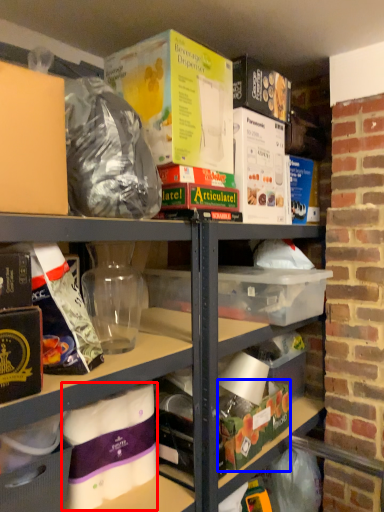
Question: Which object is further to the camera taking this photo, yoghurt (highlighted by a red box) or storage box (highlighted by a blue box)?

Choices:
 (A) yoghurt
 (B) storage box

Answer: (B)